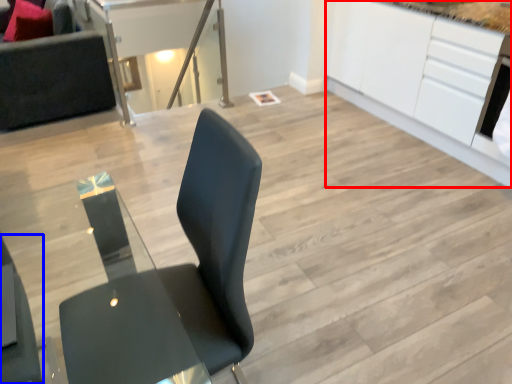
Question: Which object is further to the camera taking this photo, cabinetry (highlighted by a red box) or chair (highlighted by a blue box)?

Choices:
 (A) cabinetry
 (B) chair

Answer: (A)